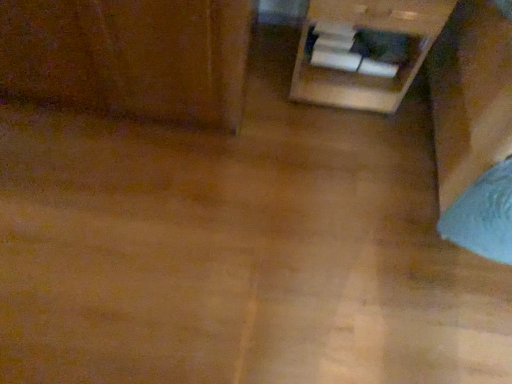
The height and width of the screenshot is (384, 512). What do you see at coordinates (364, 74) in the screenshot?
I see `wooden drawer at upper right` at bounding box center [364, 74].

You are a GUI agent. You are given a task and a screenshot of the screen. Output one action in this format:
    pyautogui.click(x=<x>, y=<y>)
    Task: Click on the wooden drawer at upper right
    
    Given the screenshot: What is the action you would take?
    pyautogui.click(x=364, y=74)

In order to click on wooden drawer at upper right in this screenshot , I will do `click(364, 74)`.